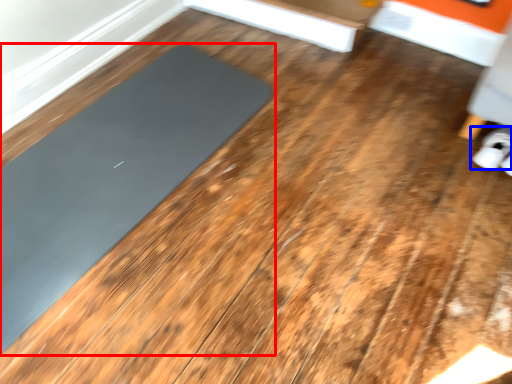
Question: Among these objects, which one is farthest to the camera, mat (highlighted by a red box) or footwear (highlighted by a blue box)?

Choices:
 (A) mat
 (B) footwear

Answer: (B)